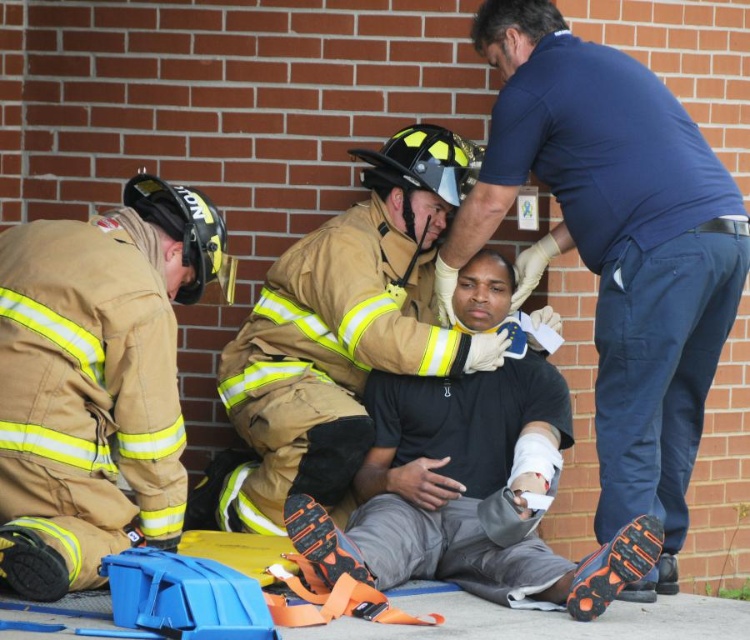
You are an emergency responder assessing the scene. You notice a point at coordinates (615, 248). What object is located at this point?

The point at coordinates (615, 248) corresponds to the blue cotton shirt at upper center.

You are a paramedic assessing the scene. You need to place a medical kit at a point that is exactly 15 feet away from the viewer. Is the point at coordinates point (672, 381) suitable for placing the medical kit?

The distance of point (672, 381) from viewer is 17.83 feet, which is farther than the required 15 feet. Therefore, the point is not suitable for placing the medical kit.